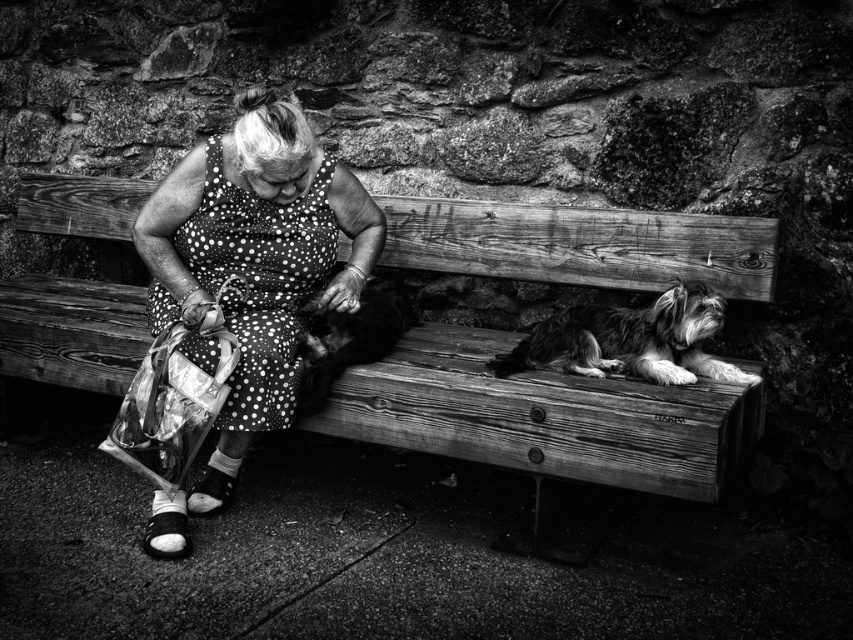
From the picture: Between wooden bench at center and shaggy fur dog at right, which one is positioned higher?

wooden bench at center

Is wooden bench at center below shaggy fur dog at right?

No, wooden bench at center is not below shaggy fur dog at right.

What are the coordinates of `wooden bench at center` in the screenshot? It's located at (544, 417).

Can you confirm if polka dot fabric dress at center is wider than soft fur dog at center?

Yes.

Who is more distant from viewer, (193, 195) or (329, 339)?

The point (193, 195) is behind.

You are a GUI agent. You are given a task and a screenshot of the screen. Output one action in this format:
    pyautogui.click(x=<x>, y=<y>)
    Task: Click on the polka dot fabric dress at center
    
    Given the screenshot: What is the action you would take?
    pyautogui.click(x=250, y=275)

Which is more to the left, polka dot fabric dress at center or shaggy fur dog at right?

polka dot fabric dress at center is more to the left.

Is point (189, 500) closer to camera compared to point (567, 323)?

No, (189, 500) is further to viewer.

At what (x,y) coordinates should I click in order to perform the action: click on polka dot fabric dress at center. Please return your answer as a coordinate pair (x, y). Image resolution: width=853 pixels, height=640 pixels. Looking at the image, I should click on (250, 275).